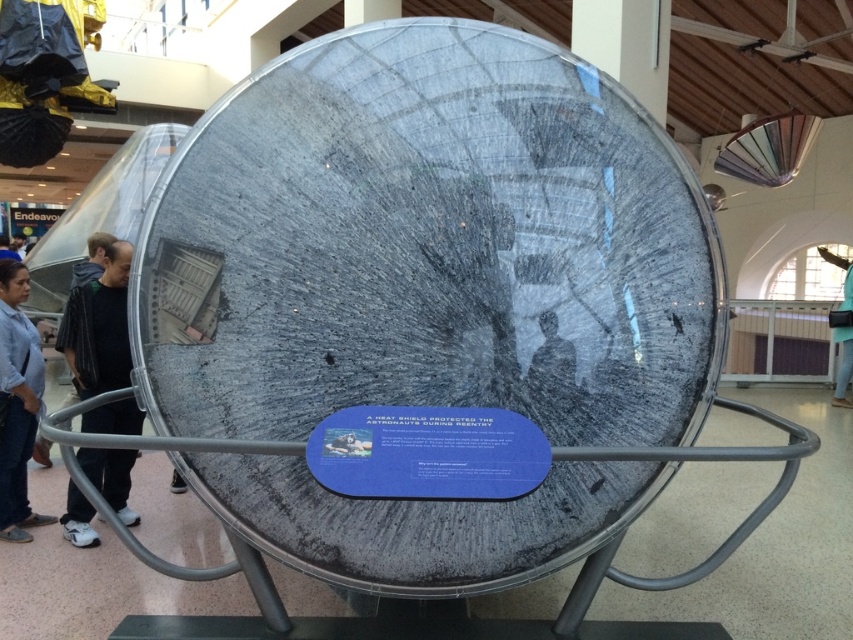
Is denim jeans at lower left in front of matte black helmet at center?

No.

Is point (3, 472) closer to viewer compared to point (552, 349)?

No, it is behind (552, 349).

The image size is (853, 640). In order to click on denim jeans at lower left in this screenshot , I will do `click(16, 403)`.

Does dark gray fabric jacket at left have a lesser height compared to matte black helmet at center?

No.

Who is more forward, [125,275] or [543,376]?

Positioned in front is point [543,376].

Image resolution: width=853 pixels, height=640 pixels. I want to click on dark gray fabric jacket at left, so 99,326.

Is dark gray fabric jacket at left further to camera compared to denim jeans at lower left?

Yes, dark gray fabric jacket at left is further from the viewer.

You are a GUI agent. You are given a task and a screenshot of the screen. Output one action in this format:
    pyautogui.click(x=<x>, y=<y>)
    Task: Click on the dark gray fabric jacket at left
    The image size is (853, 640).
    Given the screenshot: What is the action you would take?
    pyautogui.click(x=99, y=326)

Does point (67, 358) lie in front of point (12, 273)?

Yes, it is in front of point (12, 273).

You are a GUI agent. You are given a task and a screenshot of the screen. Output one action in this format:
    pyautogui.click(x=<x>, y=<y>)
    Task: Click on the dark gray fabric jacket at left
    This screenshot has width=853, height=640.
    Given the screenshot: What is the action you would take?
    pyautogui.click(x=99, y=326)